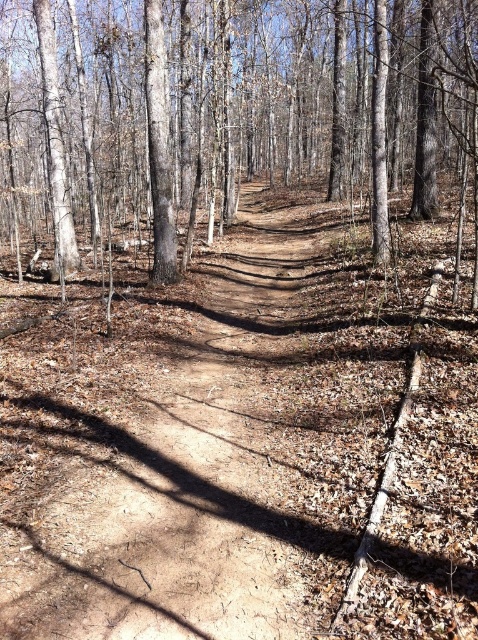
Which is more to the left, brown dirt track at center or brown smooth tree at center?

Positioned to the left is brown dirt track at center.

Find the location of a particular element. The width and height of the screenshot is (478, 640). brown dirt track at center is located at coordinates (243, 442).